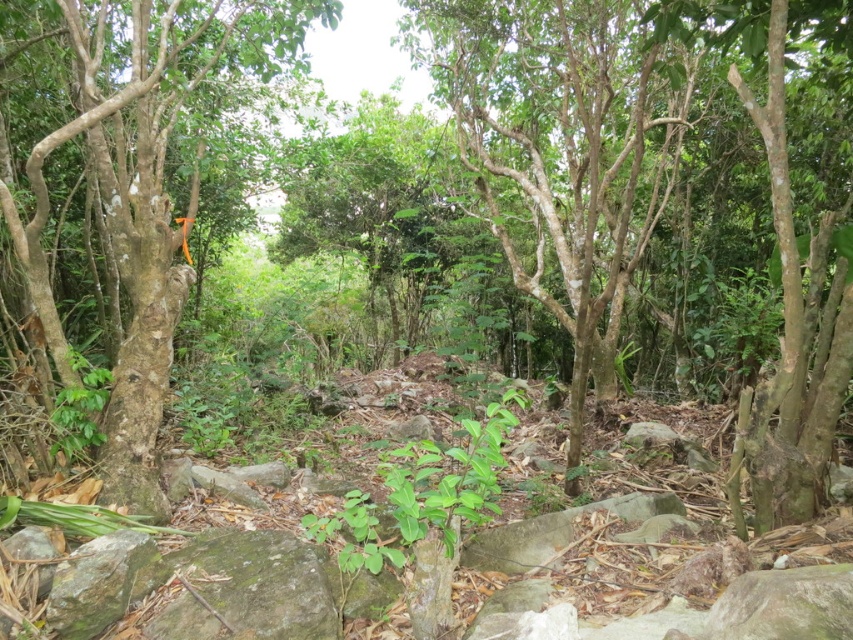
Question: Is smooth bark tree at center positioned before green rough bark tree at left?

Choices:
 (A) yes
 (B) no

Answer: (B)

Question: Is smooth bark tree at center bigger than green rough bark tree at left?

Choices:
 (A) no
 (B) yes

Answer: (A)

Question: Which point appears closest to the camera in this image?

Choices:
 (A) (144, 403)
 (B) (515, 280)

Answer: (A)

Question: In this image, where is smooth bark tree at center located relative to green rough bark tree at left?

Choices:
 (A) right
 (B) left

Answer: (A)